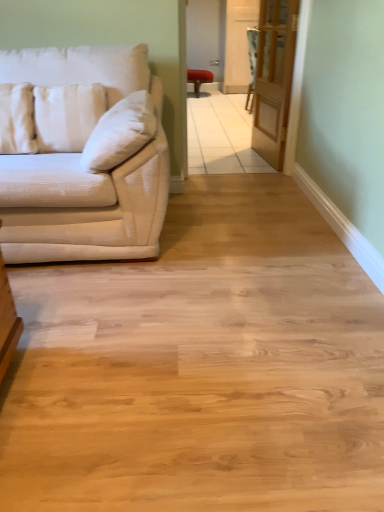
Question: In terms of height, does matte red stool at center look taller or shorter compared to velvet-like beige armchair at center?

Choices:
 (A) short
 (B) tall

Answer: (A)

Question: From the image's perspective, is matte red stool at center above or below velvet-like beige armchair at center?

Choices:
 (A) above
 (B) below

Answer: (A)

Question: Estimate the real-world distances between objects in this image. Which object is closer to the white striped pillow at left, the 1th pillow from the right?

Choices:
 (A) matte white couch at left
 (B) matte red stool at center
 (C) velvet-like beige armchair at center
 (D) clear glass door at center
 (E) white fabric pillow at left, the 2th pillow when ordered from right to left

Answer: (E)

Question: Which object is positioned closest to the white fabric pillow at left, the 2th pillow when ordered from right to left?

Choices:
 (A) white striped pillow at left, which is the second pillow in left-to-right order
 (B) velvet-like beige armchair at center
 (C) matte white couch at left
 (D) matte red stool at center
 (E) clear glass door at center

Answer: (A)